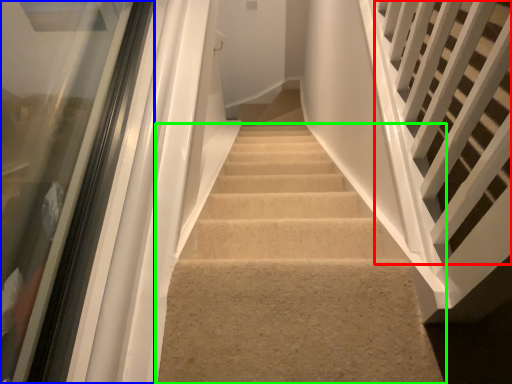
Question: Which is farther away from stairs (highlighted by a red box)? glass door (highlighted by a blue box) or stairs (highlighted by a green box)?

Choices:
 (A) glass door
 (B) stairs

Answer: (A)